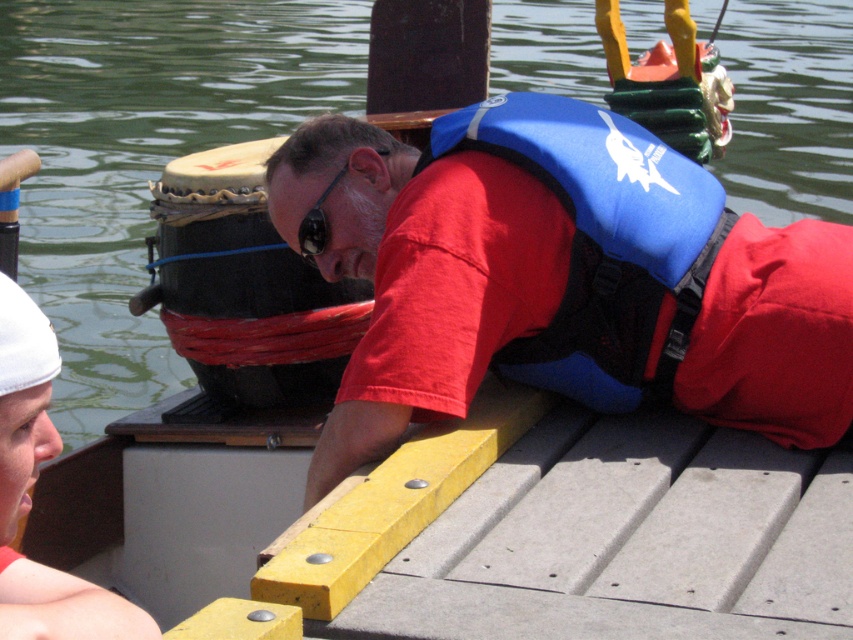
Is blue neoprene life vest at center positioned before black rubber goggles at center?

Yes, it is.

Where is `blue neoprene life vest at center`? blue neoprene life vest at center is located at coordinates (602, 241).

Between blue fabric life vest at center and black rubber goggles at center, which one has less height?

With less height is black rubber goggles at center.

Which is in front, point (314, 486) or point (305, 225)?

Positioned in front is point (314, 486).

Where is `blue fabric life vest at center`? blue fabric life vest at center is located at coordinates (561, 280).

Find the location of `blue fabric life vest at center`. blue fabric life vest at center is located at coordinates (561, 280).

Can you confirm if blue fabric life vest at center is positioned below blue neoprene life vest at center?

Correct, blue fabric life vest at center is located below blue neoprene life vest at center.

Can you confirm if blue fabric life vest at center is taller than blue neoprene life vest at center?

Yes.

The height and width of the screenshot is (640, 853). I want to click on blue fabric life vest at center, so click(x=561, y=280).